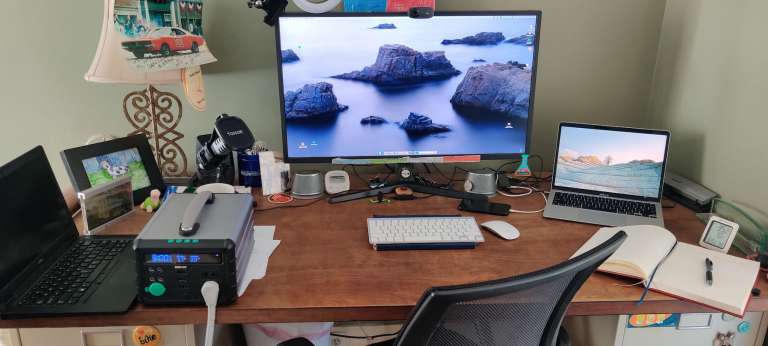
You are a GUI agent. You are given a task and a screenshot of the screen. Output one action in this format:
    pyautogui.click(x=<x>, y=<y>)
    Task: Click on the webcam
    This screenshot has height=346, width=768.
    Given the screenshot: What is the action you would take?
    pyautogui.click(x=418, y=11)